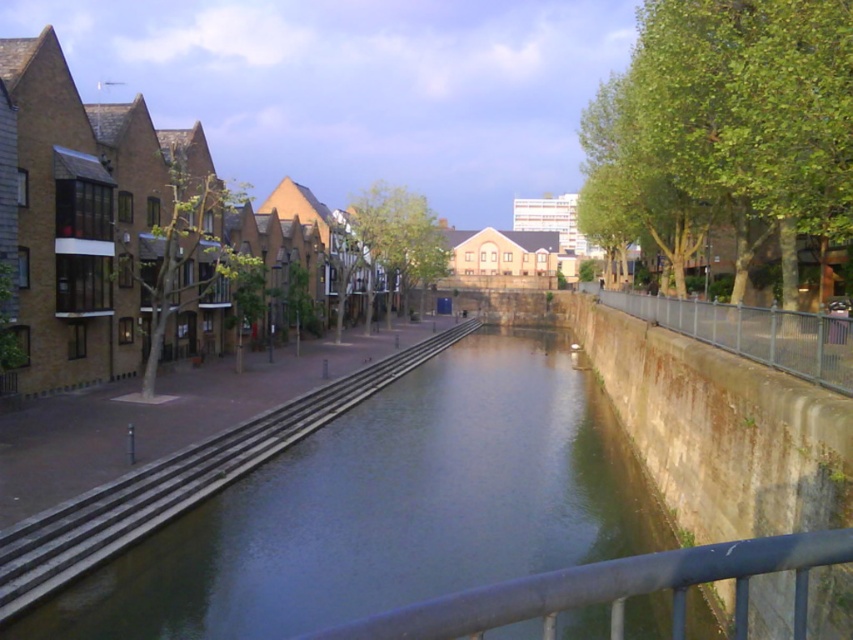
From the picture: You are a maintenance worker tasked with inspecting the metal structures along the riverside. You need to check both the smooth metal railing at center and the rusty metal fence at right. Which one should you check first if you start from the ground level and move upwards?

You should check the smooth metal railing at center first because it is located below the rusty metal fence at right, making it accessible from the ground level before moving upwards to the higher positioned rusty metal fence at right.